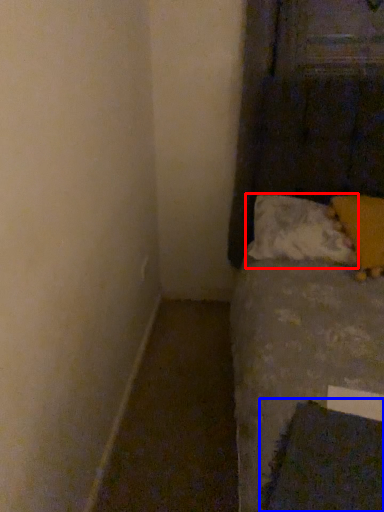
Question: Which of the following is the closest to the observer, pillow (highlighted by a red box) or sheet (highlighted by a blue box)?

Choices:
 (A) pillow
 (B) sheet

Answer: (B)